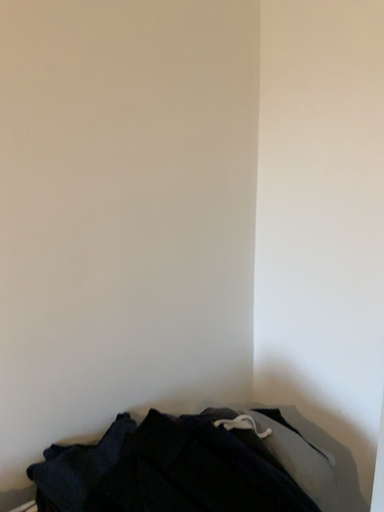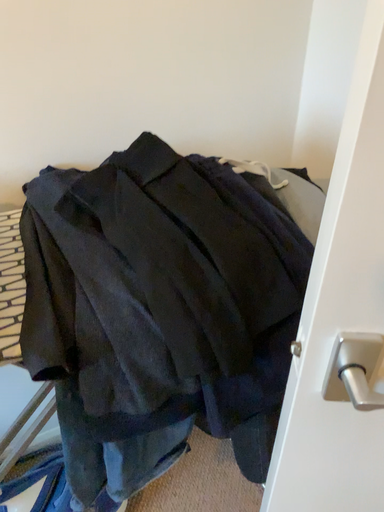
Question: Which way did the camera rotate in the video?

Choices:
 (A) rotated upward
 (B) rotated downward

Answer: (B)